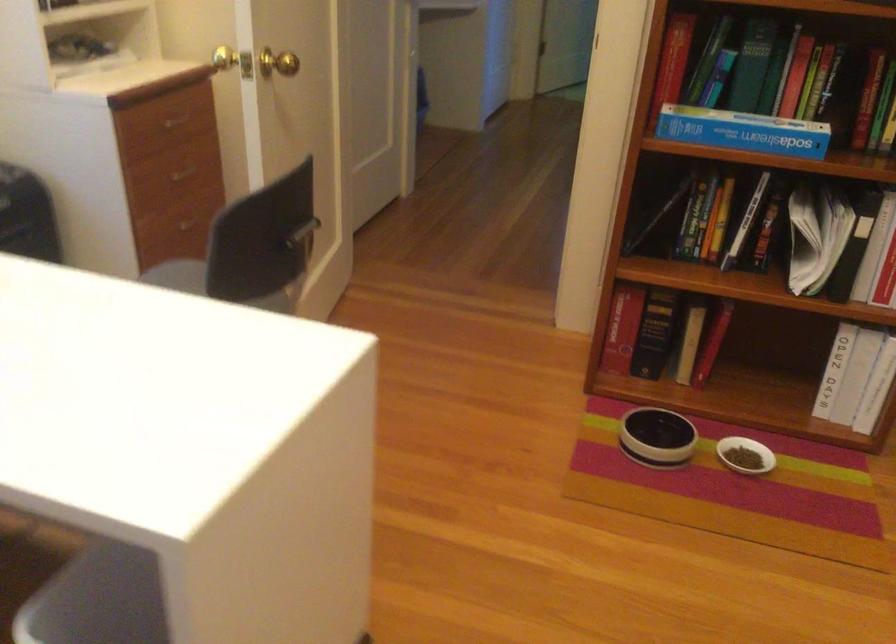
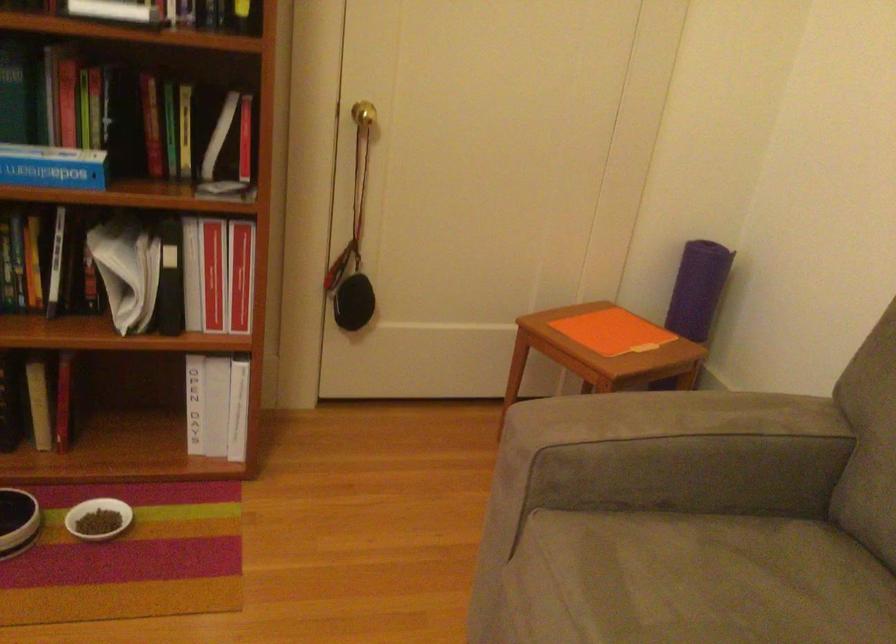
Question: The first image is from the beginning of the video and the second image is from the end. How did the camera likely rotate when shooting the video?

Choices:
 (A) Left
 (B) Right
 (C) Up
 (D) Down

Answer: (B)